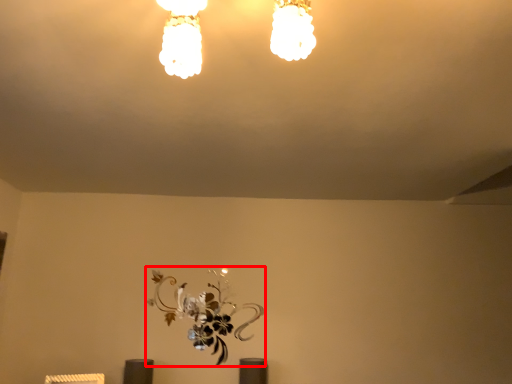
Question: From the image's perspective, where is flower (annotated by the red box) located relative to lamp?

Choices:
 (A) above
 (B) below

Answer: (B)